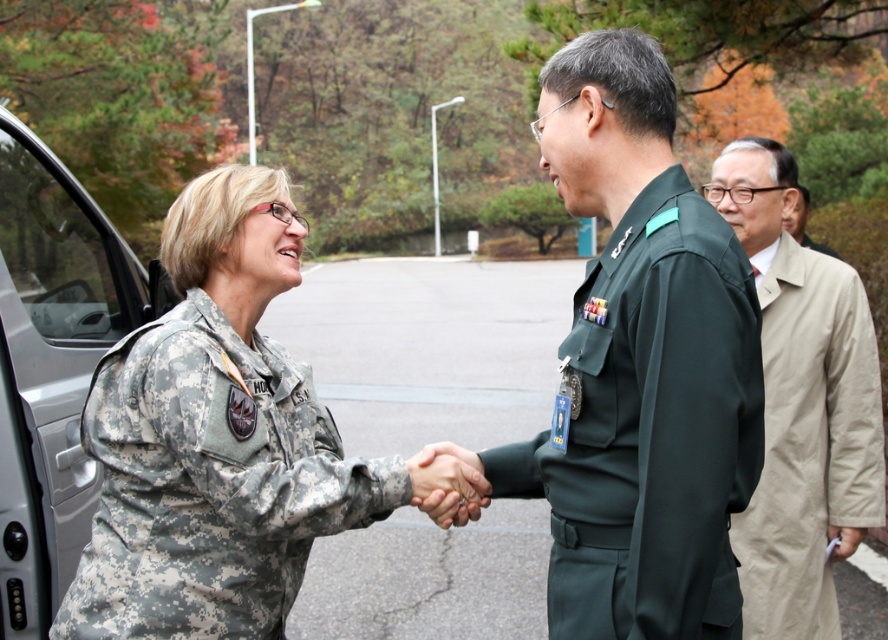
Is beige trench coat at right shorter than tan fabric coat at right?

Incorrect, beige trench coat at right's height does not fall short of tan fabric coat at right's.

What do you see at coordinates (801, 404) in the screenshot?
I see `beige trench coat at right` at bounding box center [801, 404].

Identify the location of beige trench coat at right. (801, 404).

Does camouflage fabric car at left have a smaller size compared to camouflage fabric hand at center?

Incorrect, camouflage fabric car at left is not smaller in size than camouflage fabric hand at center.

Who is shorter, camouflage fabric car at left or camouflage fabric hand at center?

camouflage fabric hand at center is shorter.

Is point (101, 330) behind point (427, 474)?

Yes, it is behind point (427, 474).

Identify the location of camouflage fabric car at left. (53, 365).

Between camouflage fabric uniform at center and camouflage fabric car at left, which one has less height?

With less height is camouflage fabric uniform at center.

Does camouflage fabric uniform at center have a lesser width compared to camouflage fabric car at left?

No, camouflage fabric uniform at center is not thinner than camouflage fabric car at left.

Does point (197, 547) lie behind point (28, 412)?

No, (197, 547) is in front of (28, 412).

Find the location of `camouflage fabric uniform at center`. camouflage fabric uniform at center is located at coordinates (209, 484).